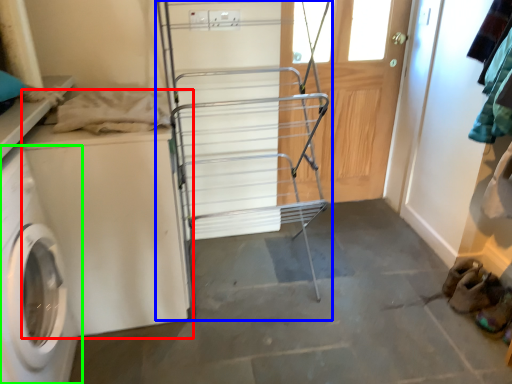
Question: Which object is the farthest from washing machine (highlighted by a red box)? Choose among these: trolley (highlighted by a blue box) or washing machine (highlighted by a green box).

Choices:
 (A) trolley
 (B) washing machine

Answer: (A)